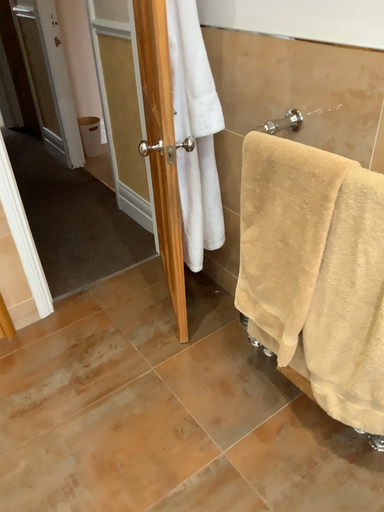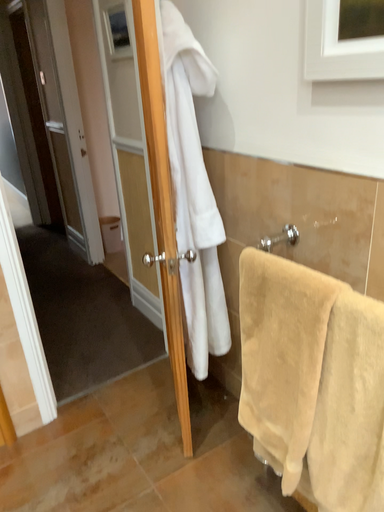
Question: Which way did the camera rotate in the video?

Choices:
 (A) rotated upward
 (B) rotated downward

Answer: (A)